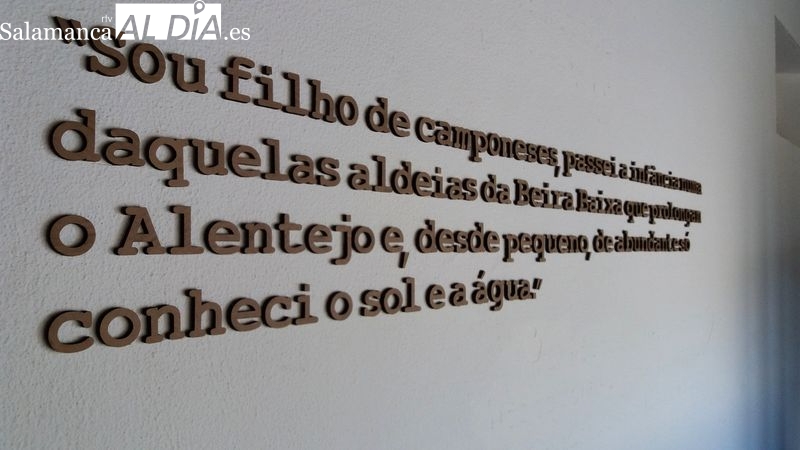
Identify the location of white textured wall. (49, 413).